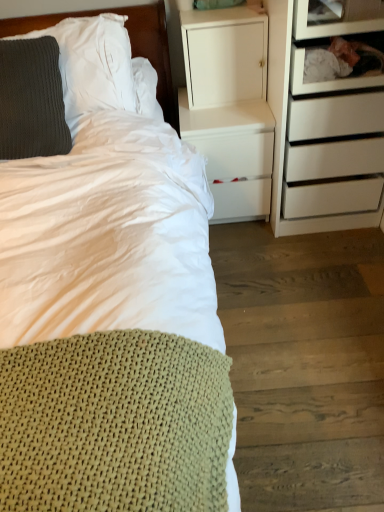
Find the location of `free space in front of white matte nightstand at center`. free space in front of white matte nightstand at center is located at coordinates (255, 249).